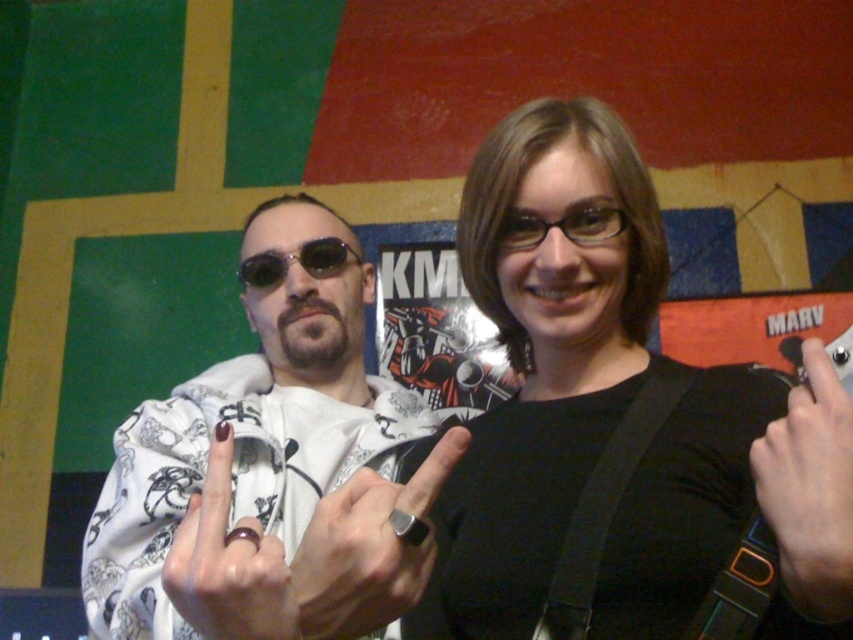
You are a photographer trying to capture a closeup shot of the black matte shirt at center and the black leather hand at center. Since you want to focus on the details of both objects, which one should you zoom in more on to ensure it fills the frame appropriately?

The black matte shirt at center is wider than the black leather hand at center, so you should zoom in more on the black leather hand at center to ensure it fills the frame appropriately.

What are the coordinates of the black matte shirt at center in the image?

The black matte shirt at center is located at coordinates point [618,420].